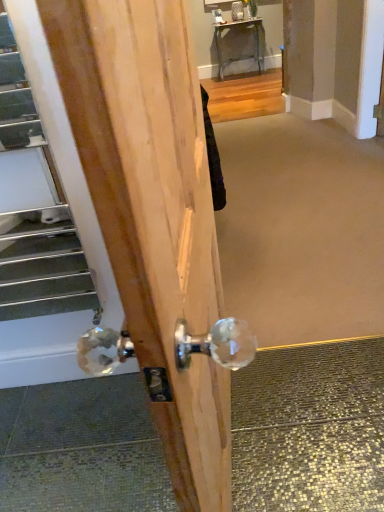
Question: Does metallic silver escalator at lower left have a lesser height compared to clear crystal doorknob at center?

Choices:
 (A) no
 (B) yes

Answer: (B)

Question: Does metallic silver escalator at lower left have a greater width compared to clear crystal doorknob at center?

Choices:
 (A) yes
 (B) no

Answer: (B)

Question: From a real-world perspective, is metallic silver escalator at lower left physically below clear crystal doorknob at center?

Choices:
 (A) no
 (B) yes

Answer: (A)

Question: Is the depth of metallic silver escalator at lower left greater than that of clear crystal doorknob at center?

Choices:
 (A) yes
 (B) no

Answer: (A)

Question: Can you confirm if metallic silver escalator at lower left is bigger than clear crystal doorknob at center?

Choices:
 (A) no
 (B) yes

Answer: (A)

Question: From their relative heights in the image, would you say metallic silver table at upper center is taller or shorter than clear crystal doorknob at center?

Choices:
 (A) tall
 (B) short

Answer: (B)

Question: Considering the relative positions of metallic silver table at upper center and clear crystal doorknob at center in the image provided, is metallic silver table at upper center to the left or to the right of clear crystal doorknob at center?

Choices:
 (A) left
 (B) right

Answer: (B)

Question: Is metallic silver table at upper center wider or thinner than clear crystal doorknob at center?

Choices:
 (A) thin
 (B) wide

Answer: (A)

Question: From the image's perspective, is metallic silver table at upper center above or below clear crystal doorknob at center?

Choices:
 (A) below
 (B) above

Answer: (B)

Question: Relative to clear crystal doorknob at center, is metallic silver escalator at lower left in front or behind?

Choices:
 (A) behind
 (B) front

Answer: (A)

Question: Is metallic silver escalator at lower left bigger or smaller than clear crystal doorknob at center?

Choices:
 (A) small
 (B) big

Answer: (A)

Question: From the image's perspective, relative to clear crystal doorknob at center, is metallic silver escalator at lower left above or below?

Choices:
 (A) below
 (B) above

Answer: (B)

Question: In the image, is metallic silver escalator at lower left on the left side or the right side of clear crystal doorknob at center?

Choices:
 (A) left
 (B) right

Answer: (A)

Question: Based on their sizes in the image, would you say metallic silver table at upper center is bigger or smaller than metallic silver escalator at lower left?

Choices:
 (A) small
 (B) big

Answer: (B)

Question: Is metallic silver table at upper center wider or thinner than metallic silver escalator at lower left?

Choices:
 (A) wide
 (B) thin

Answer: (A)